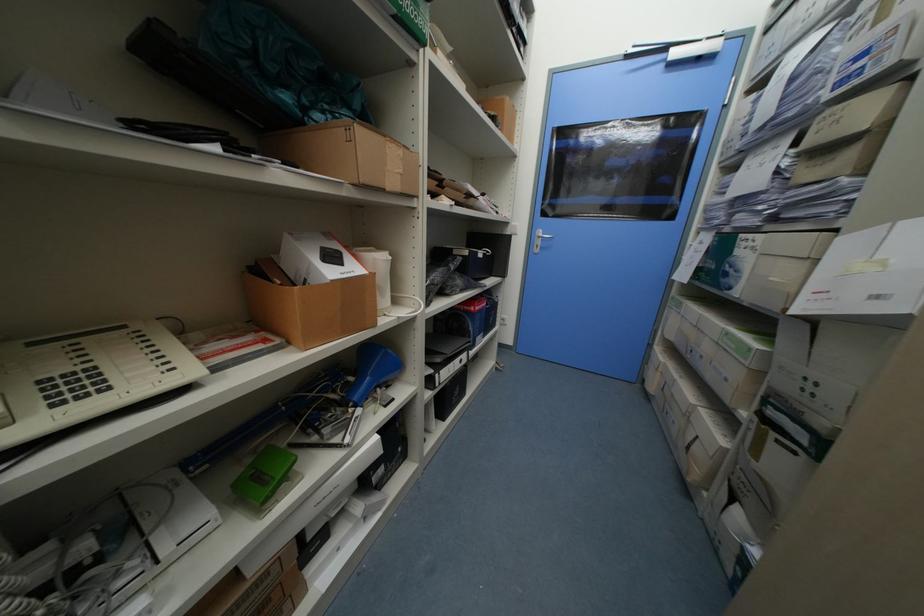
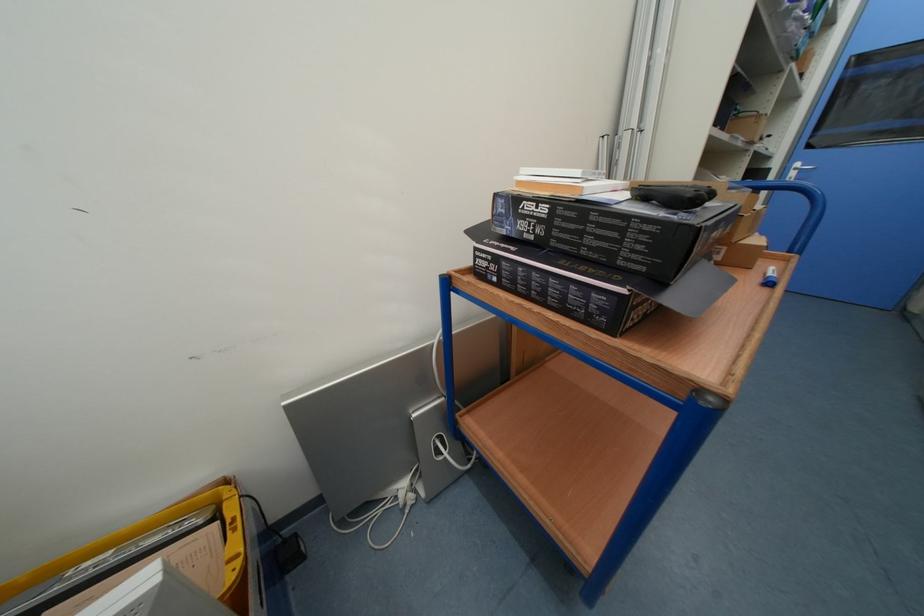
Find the pixel in the second image that matches the point at 545,233 in the first image.

(804, 166)